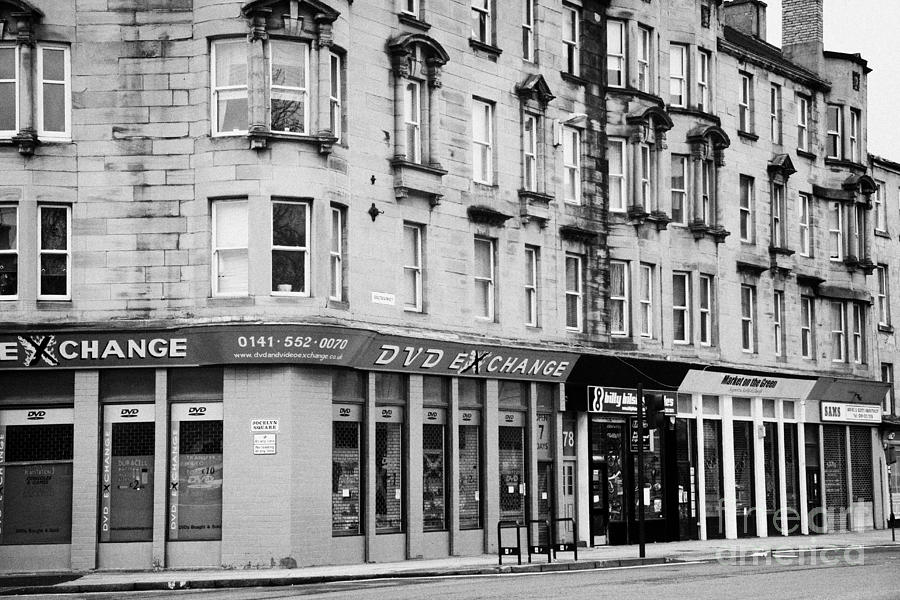
Identify the location of handles. (514, 529), (540, 526).